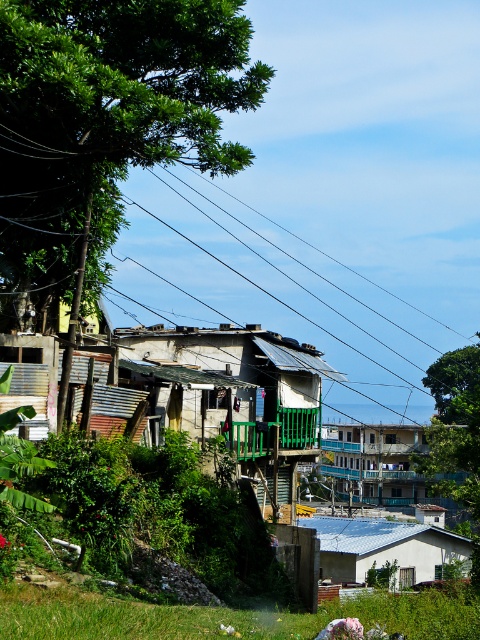
Question: Based on their relative distances, which object is nearer to the rusty corrugated metal hut at center?

Choices:
 (A) blue painted wood balcony at center
 (B) green leafy tree at upper left
 (C) black wire at upper center

Answer: (B)

Question: Can you confirm if black wire at upper center is wider than white matte house at lower right?

Choices:
 (A) yes
 (B) no

Answer: (A)

Question: Does black wire at upper center have a smaller size compared to blue painted wood balcony at center?

Choices:
 (A) yes
 (B) no

Answer: (B)

Question: Among these objects, which one is farthest from the camera?

Choices:
 (A) green leafy tree at upper center
 (B) green leafy tree at upper left

Answer: (A)

Question: Considering the real-world distances, which object is farthest from the black wire at upper center?

Choices:
 (A) white matte house at lower right
 (B) green leafy tree at upper left
 (C) blue painted wood balcony at center
 (D) green leafy tree at upper center

Answer: (B)

Question: Considering the relative positions of white matte house at lower right and blue painted wood balcony at center in the image provided, where is white matte house at lower right located with respect to blue painted wood balcony at center?

Choices:
 (A) right
 (B) left

Answer: (B)